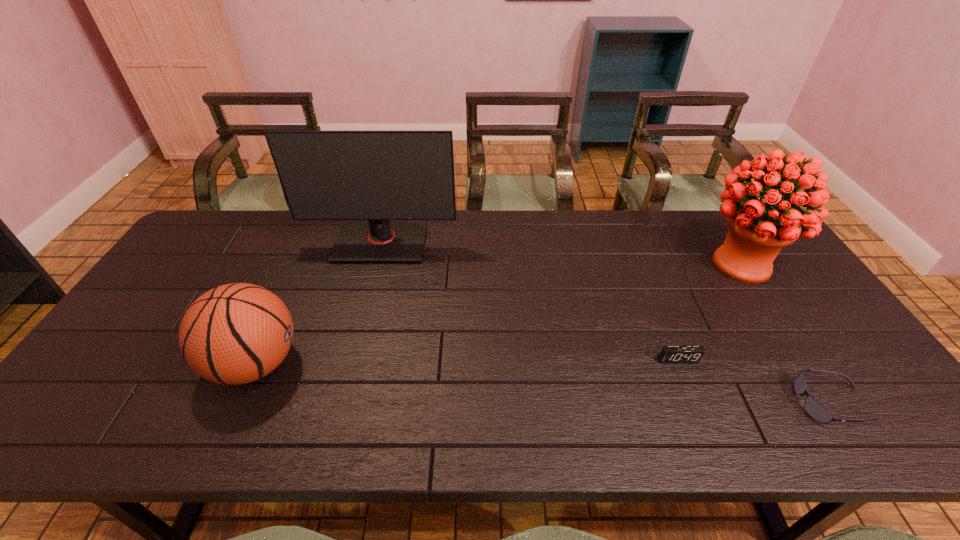
Locate an element on the screen. free space between the sunglasses and the bouquet is located at coordinates (786, 333).

Identify the location of vacant region between the sunglasses and the monitor. This screenshot has width=960, height=540. (606, 323).

Where is `vacant area that lies between the sunglasses and the alarm clock`? vacant area that lies between the sunglasses and the alarm clock is located at coordinates point(755,381).

Locate which object ranks second in proximity to the sunglasses. Please provide its 2D coordinates. Your answer should be formatted as a tuple, i.e. [(x, y)], where the tuple contains the x and y coordinates of a point satisfying the conditions above.

[(758, 230)]

Identify which object is located as the fourth nearest to the sunglasses. Please provide its 2D coordinates. Your answer should be formatted as a tuple, i.e. [(x, y)], where the tuple contains the x and y coordinates of a point satisfying the conditions above.

[(233, 334)]

At what (x,y) coordinates should I click in order to perform the action: click on vacant region that satisfies the following two spatial constraints: 1. on the front-facing side of the third object from left to right; 2. on the side where the inflation valve is located. Please return your answer as a coordinate pair (x, y). This screenshot has width=960, height=540. Looking at the image, I should click on (680, 363).

The width and height of the screenshot is (960, 540). I want to click on blank area in the image that satisfies the following two spatial constraints: 1. on the front side of the bouquet; 2. on the side where the inflation valve is located, so click(806, 363).